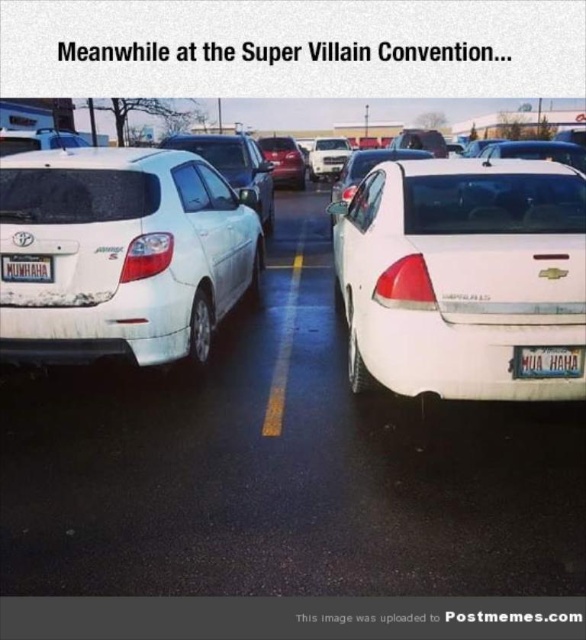
Between point (536, 364) and point (2, 280), which one is positioned in front?

Positioned in front is point (536, 364).

Is metallic blue license plate at center wider than white plastic license plate at center?

Yes.

Is point (577, 353) positioned after point (49, 276)?

No, it is not.

You are a GUI agent. You are given a task and a screenshot of the screen. Output one action in this format:
    pyautogui.click(x=<x>, y=<y>)
    Task: Click on the metallic blue license plate at center
    This screenshot has width=586, height=640.
    Given the screenshot: What is the action you would take?
    pyautogui.click(x=546, y=362)

Looking at this image, can you confirm if satin silver sedan at center is wider than shiny red car at center?

Yes.

Measure the distance between satin silver sedan at center and camera.

satin silver sedan at center is 6.93 meters away from camera.

Measure the distance between point (220, 156) and camera.

9.88 meters

Image resolution: width=586 pixels, height=640 pixels. Identify the location of satin silver sedan at center. (234, 166).

Can you confirm if satin silver sedan at center is thinner than white plastic license plate at center?

Incorrect, satin silver sedan at center's width is not less than white plastic license plate at center's.

Which of these two, satin silver sedan at center or white plastic license plate at center, stands shorter?

white plastic license plate at center is shorter.

Describe the element at coordinates (234, 166) in the screenshot. I see `satin silver sedan at center` at that location.

This screenshot has width=586, height=640. Identify the location of satin silver sedan at center. (234, 166).